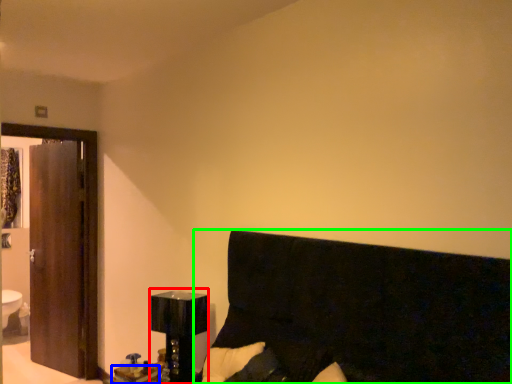
Question: Which object is the farthest from bedside lamp (highlighted by a red box)? Choose among these: table (highlighted by a blue box) or furniture (highlighted by a green box).

Choices:
 (A) table
 (B) furniture

Answer: (B)